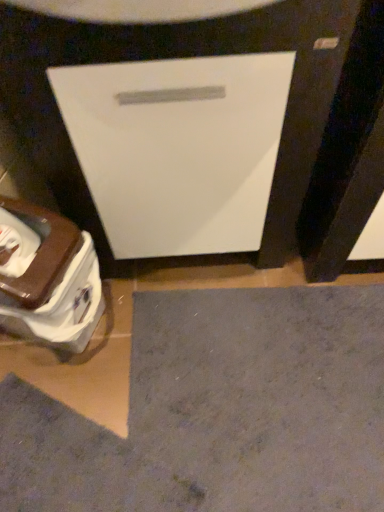
The width and height of the screenshot is (384, 512). In order to click on white matte drawer at center in this screenshot , I will do `click(178, 148)`.

The width and height of the screenshot is (384, 512). What do you see at coordinates (178, 148) in the screenshot?
I see `white matte drawer at center` at bounding box center [178, 148].

What are the coordinates of `white matte drawer at center` in the screenshot? It's located at (178, 148).